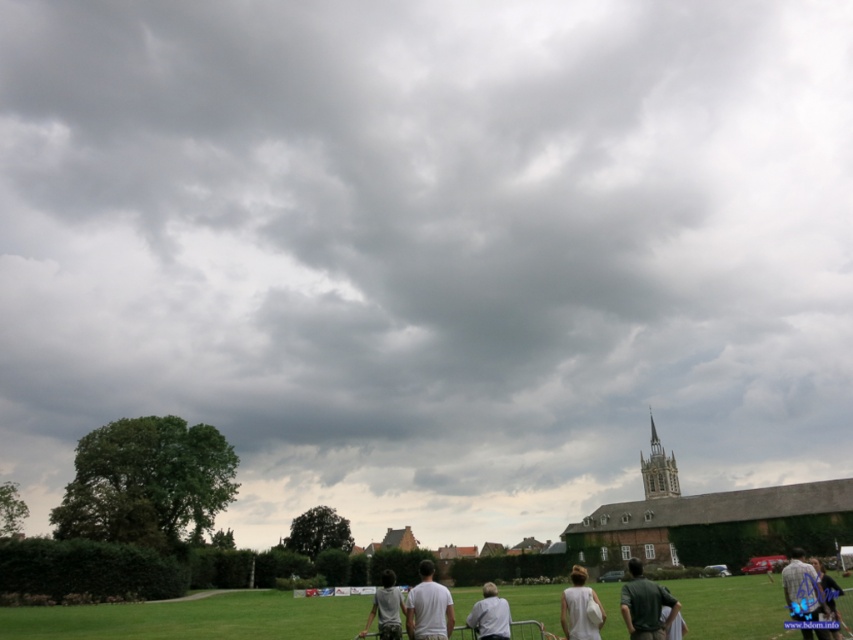
In the serene outdoor scene with a dramatic overcast sky, you notice a person wearing a white matte shirt at center and another wearing blue denim jeans at lower right. Which clothing item appears taller?

The white matte shirt at center appears taller than the blue denim jeans at lower right.

You are standing in the grassy field and see two points in the distance. The first point is at coordinates point (585,609) and the second is at point (489,586). Which point is closer to you?

Point (585,609) is in front of point (489,586), so it is closer to you.